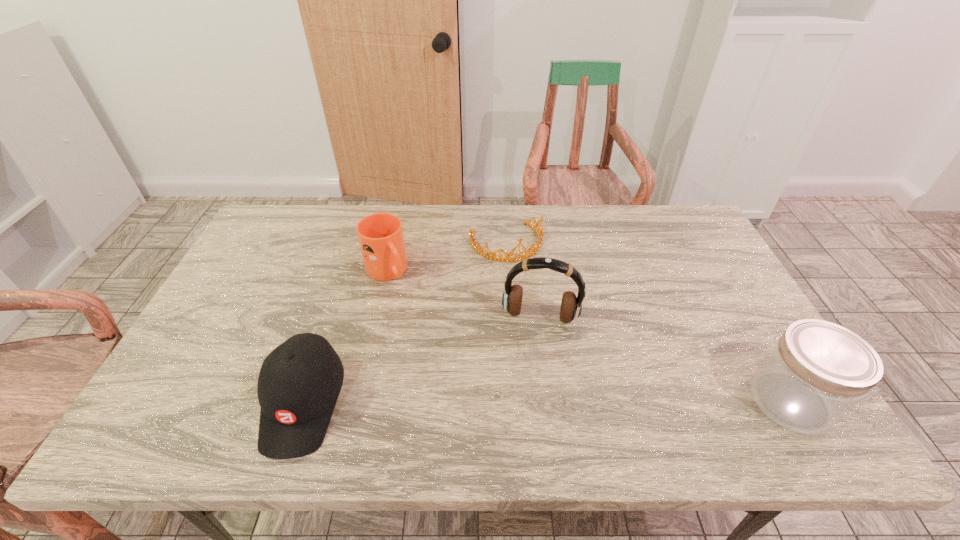
Where is `the second shortest object`? This screenshot has width=960, height=540. the second shortest object is located at coordinates (299, 382).

Find the location of a particular element. This screenshot has height=540, width=960. jar is located at coordinates (817, 371).

Find the location of a particular element. Image resolution: width=960 pixels, height=540 pixels. the shortest object is located at coordinates (540, 234).

Where is `mug`? Image resolution: width=960 pixels, height=540 pixels. mug is located at coordinates pos(380,235).

I want to click on headset, so click(x=571, y=306).

Where is `free spot located on the left of the rightmost object`? free spot located on the left of the rightmost object is located at coordinates (706, 401).

This screenshot has height=540, width=960. Identify the location of free space located on the front-facing side of the shortest object. (545, 314).

Locate an element on the screen. This screenshot has width=960, height=540. free space located on the front-facing side of the shortest object is located at coordinates (539, 301).

You are a GUI agent. You are given a task and a screenshot of the screen. Output one action in this format:
    pyautogui.click(x=<x>, y=<y>)
    Task: Click on the vacant area located 0.300m on the front-facing side of the shortest object
    The width and height of the screenshot is (960, 540).
    Given the screenshot: What is the action you would take?
    pyautogui.click(x=557, y=335)

You are a GUI agent. You are given a task and a screenshot of the screen. Output one action in this format:
    pyautogui.click(x=<x>, y=<y>)
    Task: Click on the vacant position located on the handle side of the mug
    
    Given the screenshot: What is the action you would take?
    pyautogui.click(x=426, y=322)